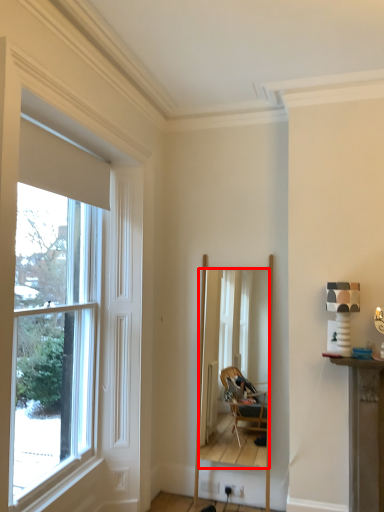
Question: Observing the image, what is the correct spatial positioning of mirror (annotated by the red box) in reference to window?

Choices:
 (A) left
 (B) right

Answer: (B)